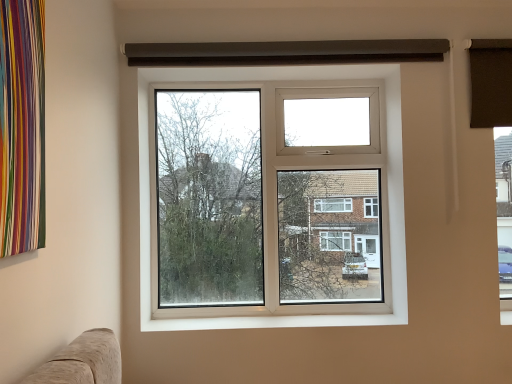
Question: From a real-world perspective, is white plastic window at center above or below white smooth window sill at lower center?

Choices:
 (A) below
 (B) above

Answer: (B)

Question: In the image, is white plastic window at center positioned in front of or behind white smooth window sill at lower center?

Choices:
 (A) behind
 (B) front

Answer: (A)

Question: Is point (399, 139) positioned closer to the camera than point (283, 327)?

Choices:
 (A) closer
 (B) farther

Answer: (B)

Question: Considering the positions of white smooth window sill at lower center and white plastic window at center in the image, is white smooth window sill at lower center wider or thinner than white plastic window at center?

Choices:
 (A) wide
 (B) thin

Answer: (A)

Question: Is point (274, 314) positioned closer to the camera than point (293, 319)?

Choices:
 (A) farther
 (B) closer

Answer: (A)

Question: Do you think white smooth window sill at lower center is within white plastic window at center, or outside of it?

Choices:
 (A) outside
 (B) inside

Answer: (A)

Question: In terms of size, does white smooth window sill at lower center appear bigger or smaller than white plastic window at center?

Choices:
 (A) big
 (B) small

Answer: (B)